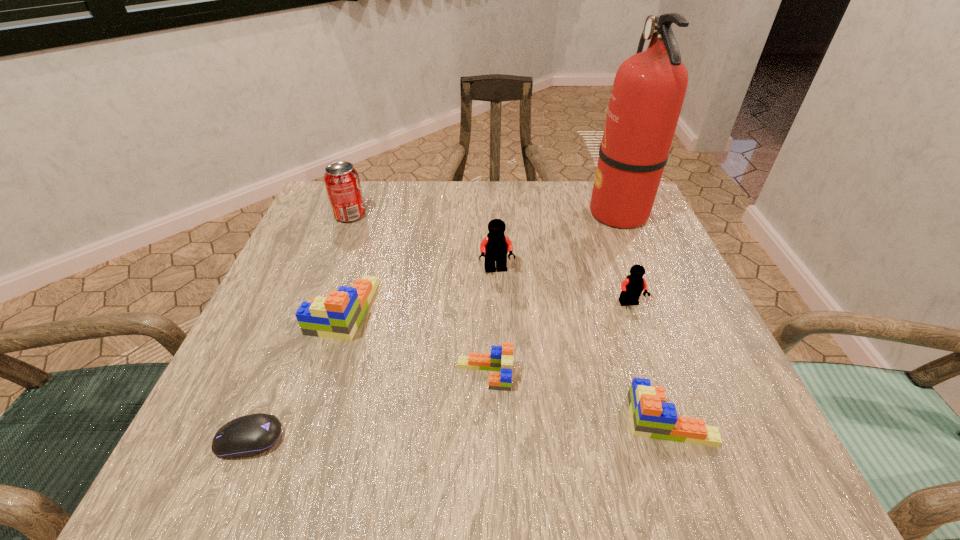
I want to click on Lego that is at the left edge, so click(x=337, y=316).

Find the location of a particular element. This screenshot has width=960, height=540. computer mouse positioned at the left edge is located at coordinates (246, 436).

Locate an element on the screen. fire extinguisher located at the right edge is located at coordinates (649, 88).

Find the location of `object at the far left corner`. object at the far left corner is located at coordinates (341, 179).

The height and width of the screenshot is (540, 960). What are the coordinates of `object located at the near left corner` in the screenshot? It's located at click(x=246, y=436).

Identify the location of object that is at the far right corner. This screenshot has width=960, height=540. (649, 88).

Identify the location of object that is at the near right corner. The height and width of the screenshot is (540, 960). (651, 417).

In the image, there is a desktop. Find the location of `vacant space at the far edge`. vacant space at the far edge is located at coordinates (563, 224).

In the image, there is a desktop. At what (x,y) coordinates should I click in order to perform the action: click on free space at the left edge. Please return your answer as a coordinate pair (x, y). The width and height of the screenshot is (960, 540). Looking at the image, I should click on (329, 260).

In the image, there is a desktop. At what (x,y) coordinates should I click in order to perform the action: click on vacant space at the right edge. Please return your answer as a coordinate pair (x, y). This screenshot has width=960, height=540. Looking at the image, I should click on (612, 257).